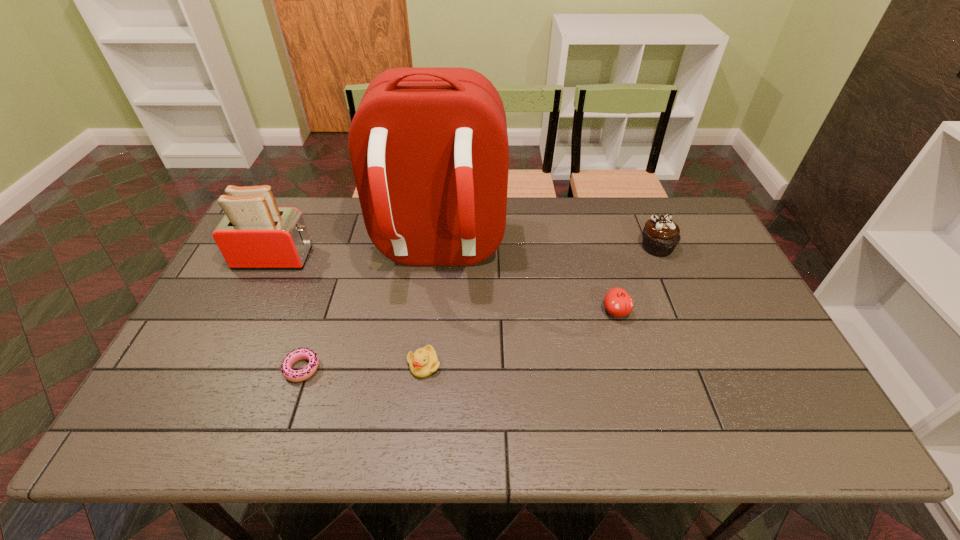
Find the location of a particular element. This screenshot has height=540, width=960. vacant space located 0.160m on the strap side of the tallest object is located at coordinates (427, 343).

Locate an element on the screen. vacant region located 0.340m on the front-facing side of the leftmost object is located at coordinates (424, 258).

I want to click on blank space located on the front of the rightmost object, so click(689, 322).

Where is `free location located 0.260m on the left of the fourth farthest object`? The height and width of the screenshot is (540, 960). free location located 0.260m on the left of the fourth farthest object is located at coordinates (508, 312).

Find the location of `free space located 0.080m on the front-facing side of the fifth tallest object`. free space located 0.080m on the front-facing side of the fifth tallest object is located at coordinates (420, 410).

Locate an element on the screen. vacant region located 0.050m on the front of the doughnut is located at coordinates (291, 403).

The width and height of the screenshot is (960, 540). Identify the location of backpack situated at the far edge. (428, 146).

Image resolution: width=960 pixels, height=540 pixels. In order to click on cupcake that is at the far edge in this screenshot , I will do `click(661, 235)`.

This screenshot has height=540, width=960. I want to click on object that is at the left edge, so click(255, 233).

Identify the location of object at the right edge. (661, 235).